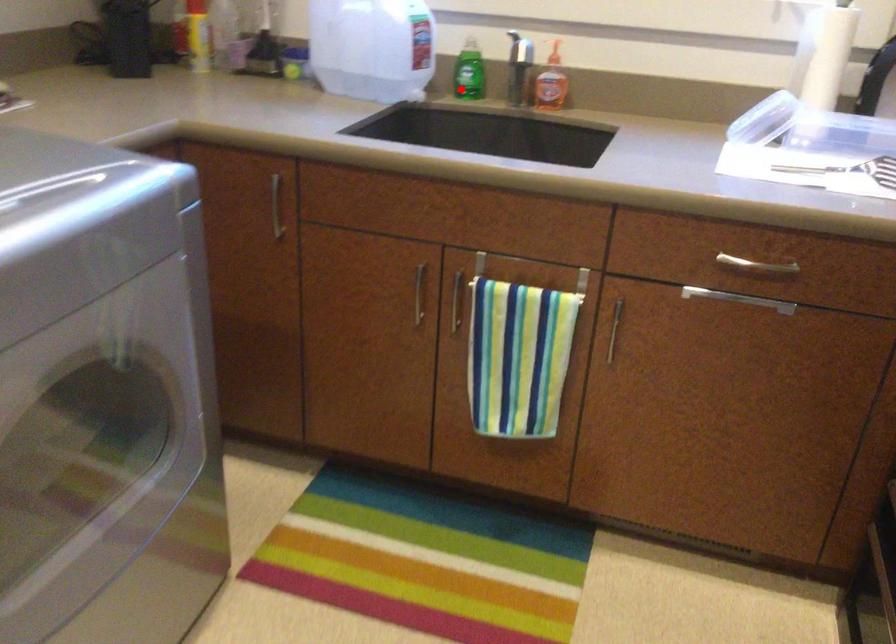
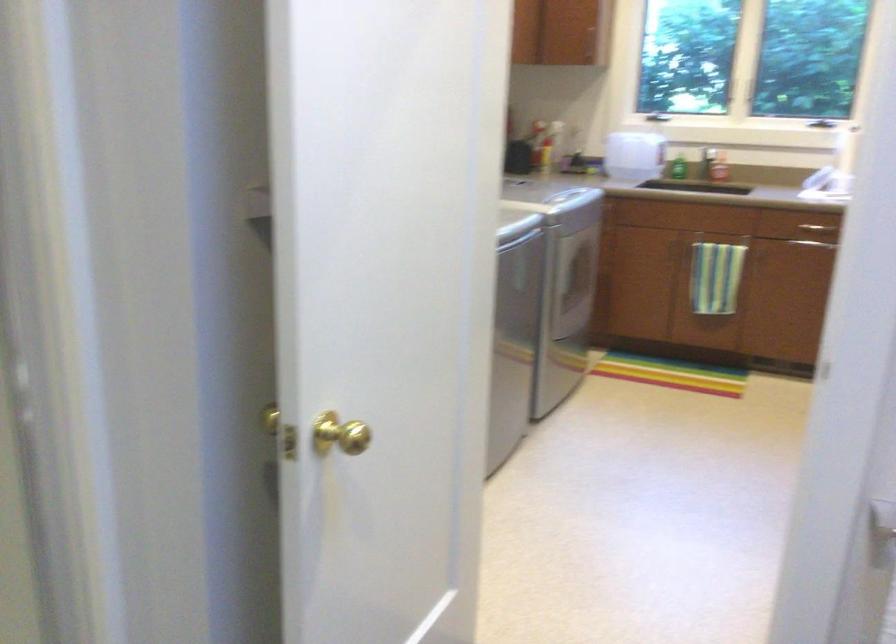
Question: I am providing you with two images of the same scene from different viewpoints. Given a red point in image1, look at the same physical point in image2. Is it:

Choices:
 (A) Closer to the viewpoint
 (B) Farther from the viewpoint

Answer: (B)